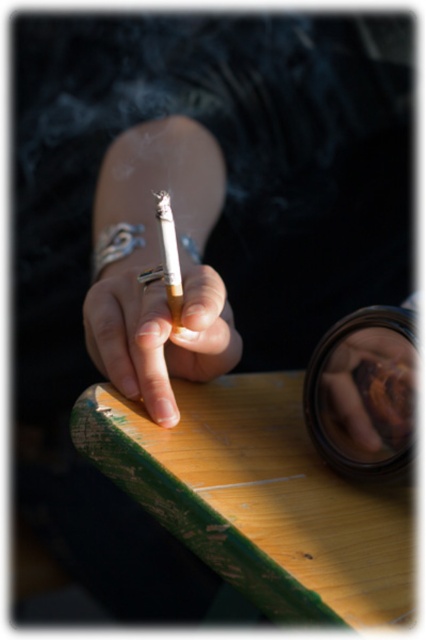
Question: In this image, where is matte yellow wood at center located relative to matte brown cigarette at center?

Choices:
 (A) above
 (B) below

Answer: (B)

Question: Which of the following is the farthest from the observer?

Choices:
 (A) (167, 301)
 (B) (204, 356)

Answer: (B)

Question: From the image, what is the correct spatial relationship of matte yellow wood at center in relation to matte brown cigarette at center?

Choices:
 (A) below
 (B) above

Answer: (A)

Question: Which of the following is the farthest from the observer?

Choices:
 (A) (170, 284)
 (B) (126, 324)

Answer: (B)

Question: Which point is farther to the camera?

Choices:
 (A) (120, 380)
 (B) (158, 218)

Answer: (A)

Question: Does matte yellow wood at center have a larger size compared to matte brown cigarette at center?

Choices:
 (A) no
 (B) yes

Answer: (B)